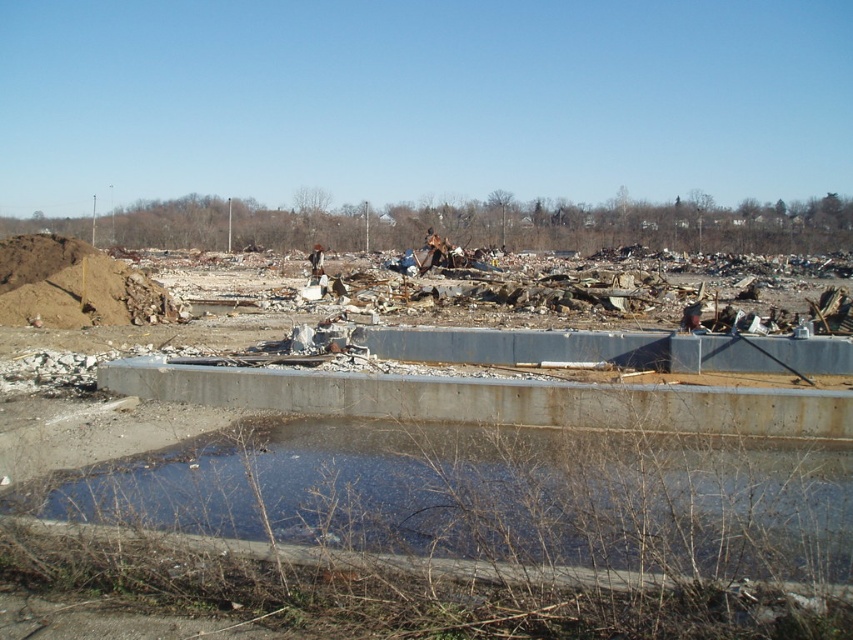
You are a construction worker assessing the site. You need to determine the order of objects from nearest to farthest from your viewpoint. Which is closer to you between the concrete debris at center and the clear concrete water at center?

The concrete debris at center is closer to you because it is in front of the clear concrete water at center according to the description.

You are a construction worker tasked with assessing the site. You notice the concrete debris at center and the clear concrete water at center. Which object is taller?

The concrete debris at center is much taller than the clear concrete water at center.

From the picture: You are a construction worker tasked with assessing the site. You notice two items at the center of the area. Which one is bigger in size between the concrete debris at center and the clear concrete water at center?

The concrete debris at center is larger in size than the clear concrete water at center.